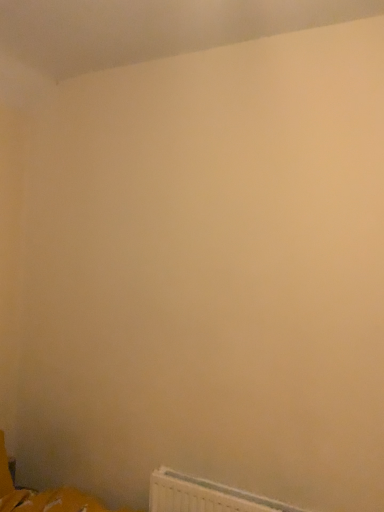
Identify the location of white plastic radiator at lower right. The width and height of the screenshot is (384, 512). (204, 496).

This screenshot has width=384, height=512. What do you see at coordinates (204, 496) in the screenshot?
I see `white plastic radiator at lower right` at bounding box center [204, 496].

Where is `white plastic radiator at lower right`? This screenshot has width=384, height=512. white plastic radiator at lower right is located at coordinates (204, 496).